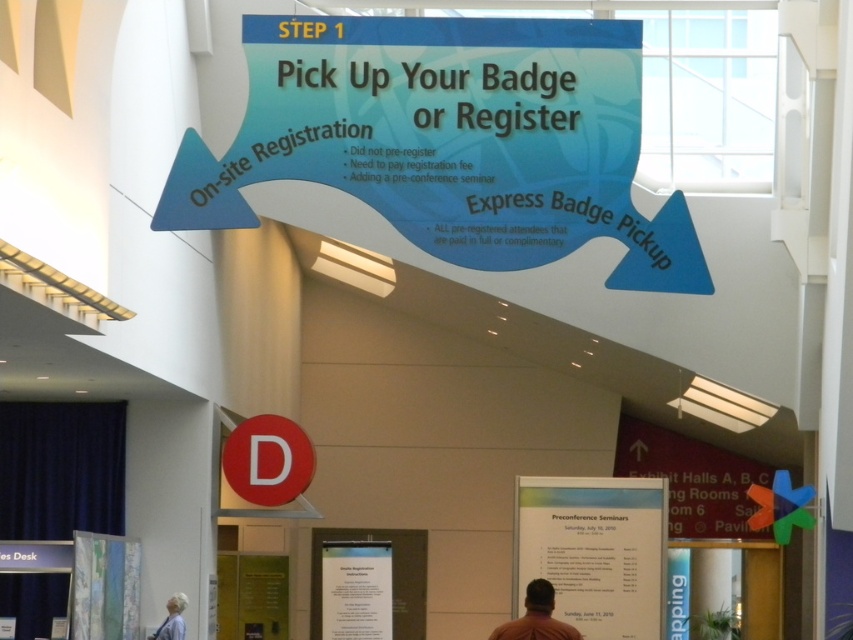
You are attending an event and see the blue arrow sign with instructions. There is a person wearing a brown shirt at center and a white fabric at lower left. Which object is closer to you?

A: The brown shirt at center is closer to you because it is in front of the white fabric at lower left.

You are attending a conference and need to decide whether to go to the on site registration or the express badge pickup. You see a brown shirt at center and a white fabric at lower left. Which direction should you go based on their positions?

The brown shirt at center is wider than the white fabric at lower left, so you should go to the express badge pickup at lower left since it is narrower and might be the correct path.